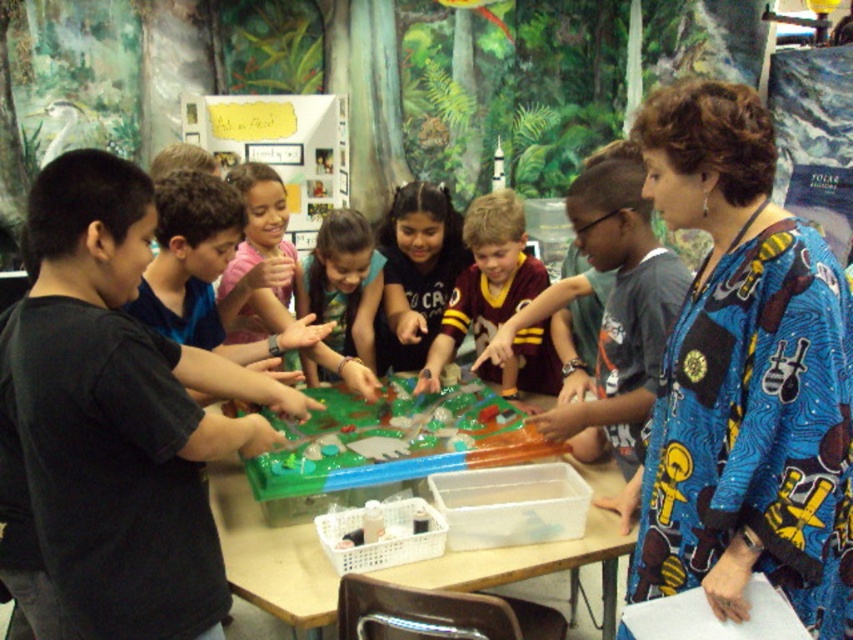
Question: Among these points, which one is nearest to the camera?

Choices:
 (A) (392, 262)
 (B) (486, 561)
 (C) (318, 252)
 (D) (338, 394)

Answer: (B)

Question: Which point is farther from the camera taking this photo?

Choices:
 (A) (701, 563)
 (B) (392, 330)
 (C) (352, 248)
 (D) (252, 516)

Answer: (B)

Question: Can you confirm if clear plastic table at center is positioned below maroon jersey at center?

Choices:
 (A) yes
 (B) no

Answer: (A)

Question: Which object is the farthest from the smooth green shirt at center?

Choices:
 (A) blue printed dress at upper right
 (B) matte brown shirt at center
 (C) maroon jersey at center

Answer: (A)

Question: Is matte brown shirt at center further to camera compared to smooth green shirt at center?

Choices:
 (A) no
 (B) yes

Answer: (B)

Question: Is clear plastic table at center to the right of smooth green shirt at center from the viewer's perspective?

Choices:
 (A) yes
 (B) no

Answer: (A)